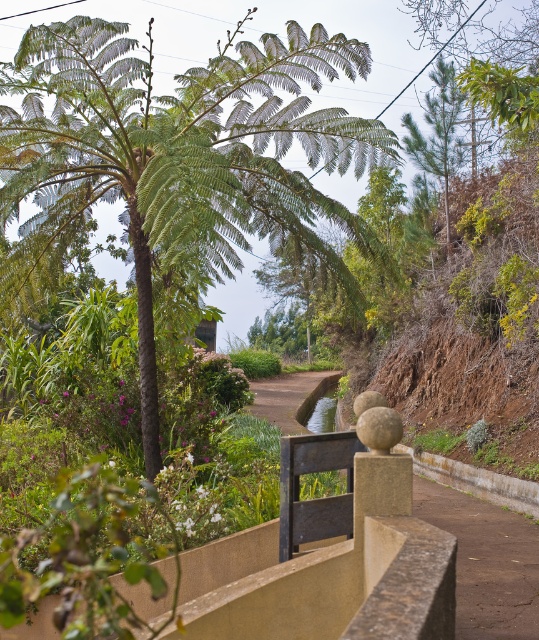
Who is positioned more to the left, green leafy palm tree at center or brown dirt path at center?

green leafy palm tree at center is more to the left.

This screenshot has height=640, width=539. What do you see at coordinates (183, 154) in the screenshot?
I see `green leafy palm tree at center` at bounding box center [183, 154].

Where is `green leafy palm tree at center`? The height and width of the screenshot is (640, 539). green leafy palm tree at center is located at coordinates (183, 154).